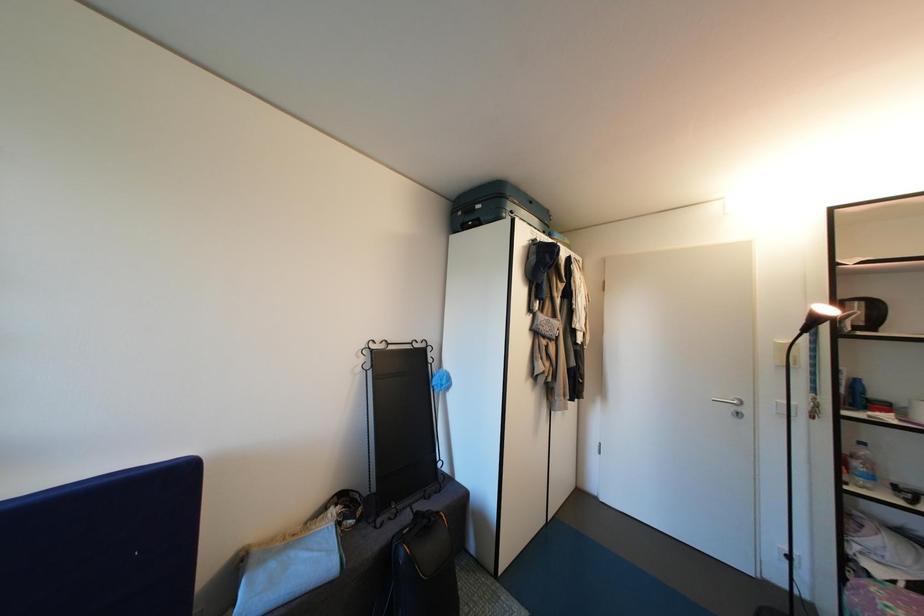
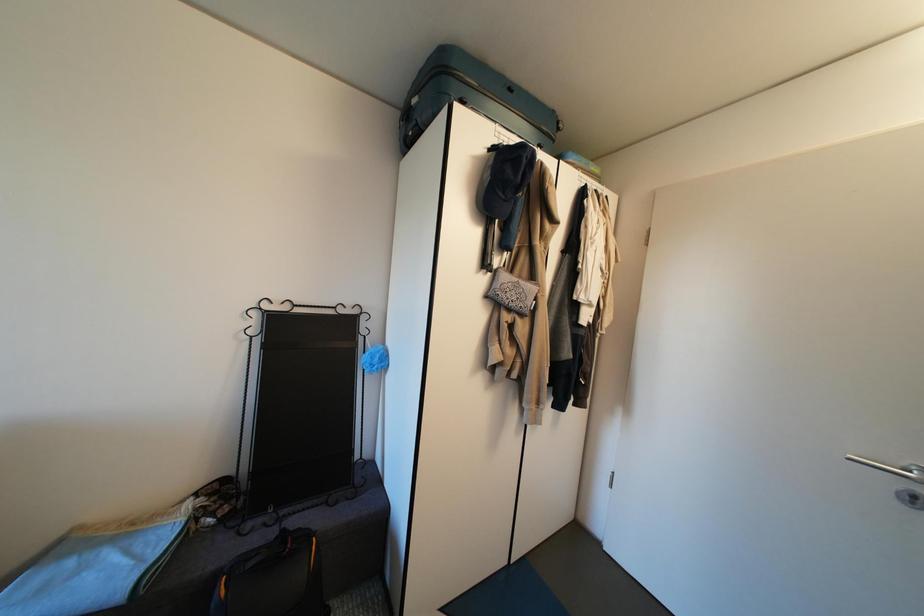
What movement of the cameraman would produce the second image?

The movement direction of the cameraman is right, forward.